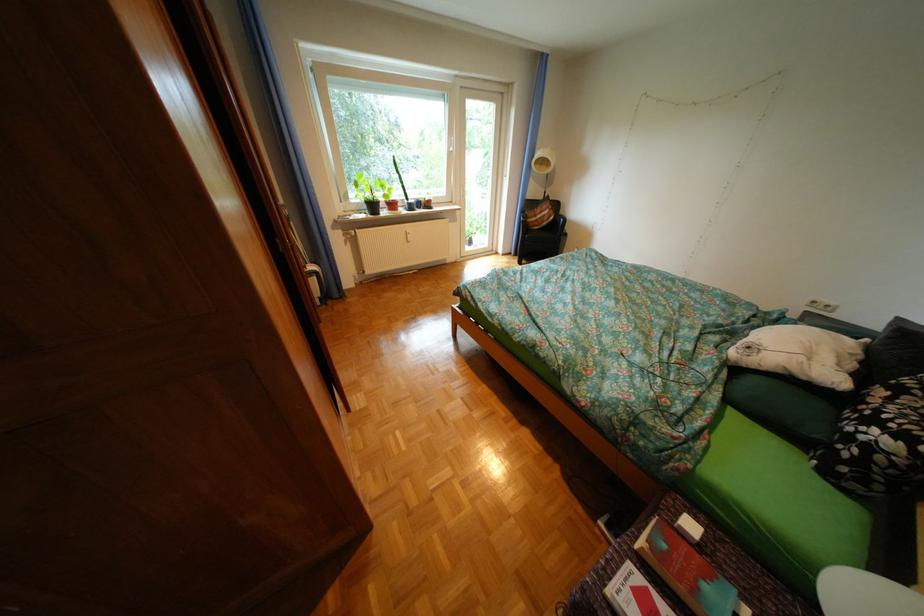
The width and height of the screenshot is (924, 616). I want to click on chair sitting surface, so click(542, 238).